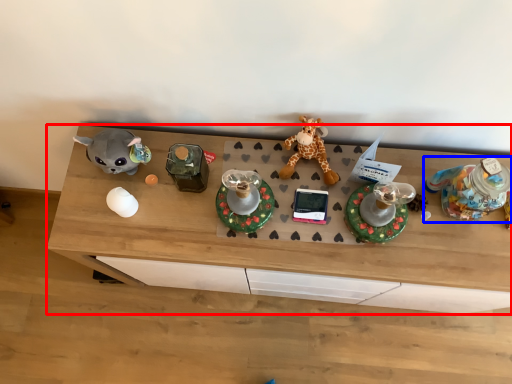
Question: Which of the following is the closest to the observer, desk (highlighted by a red box) or toy (highlighted by a blue box)?

Choices:
 (A) desk
 (B) toy

Answer: (B)